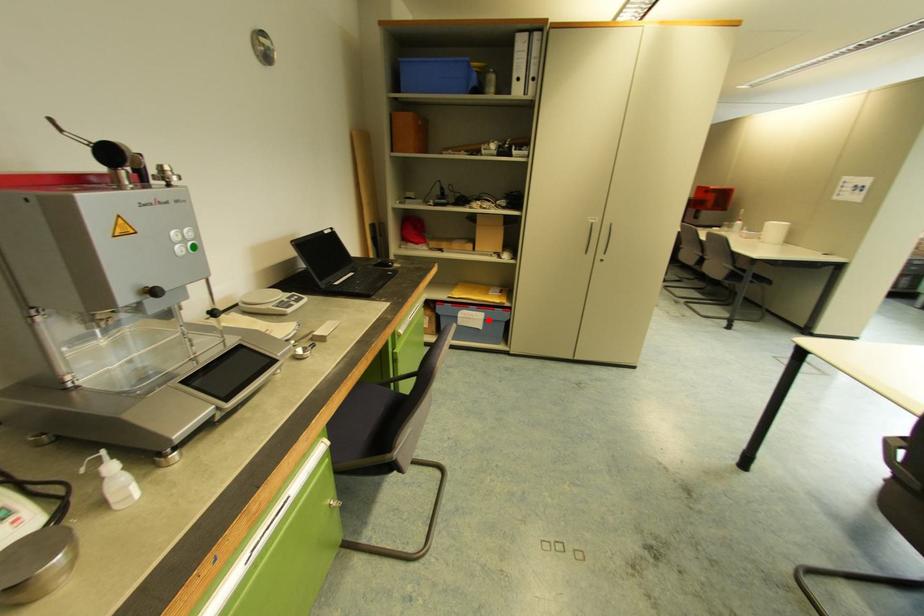
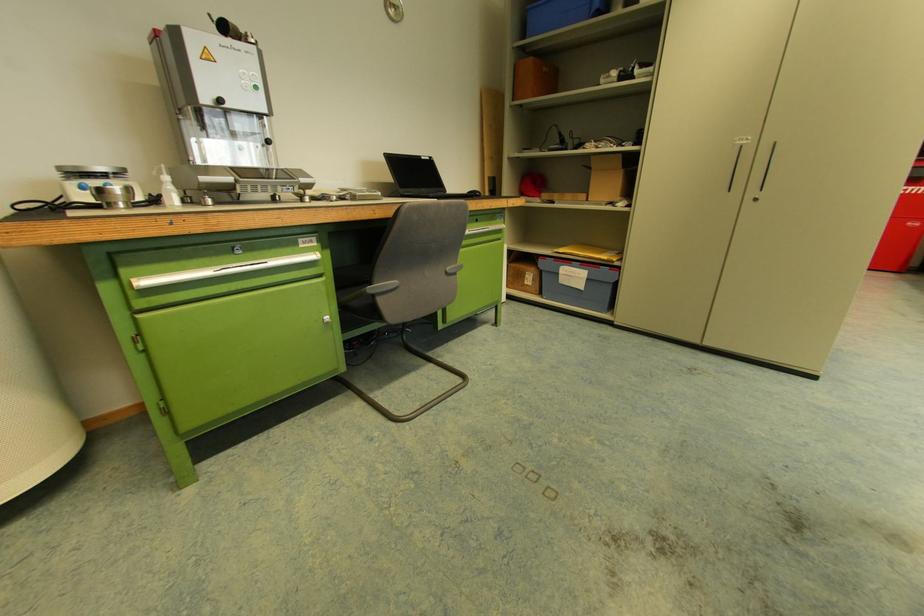
Locate, in the second image, the point that corresponds to the highlighted location in the first image.

(591, 280)